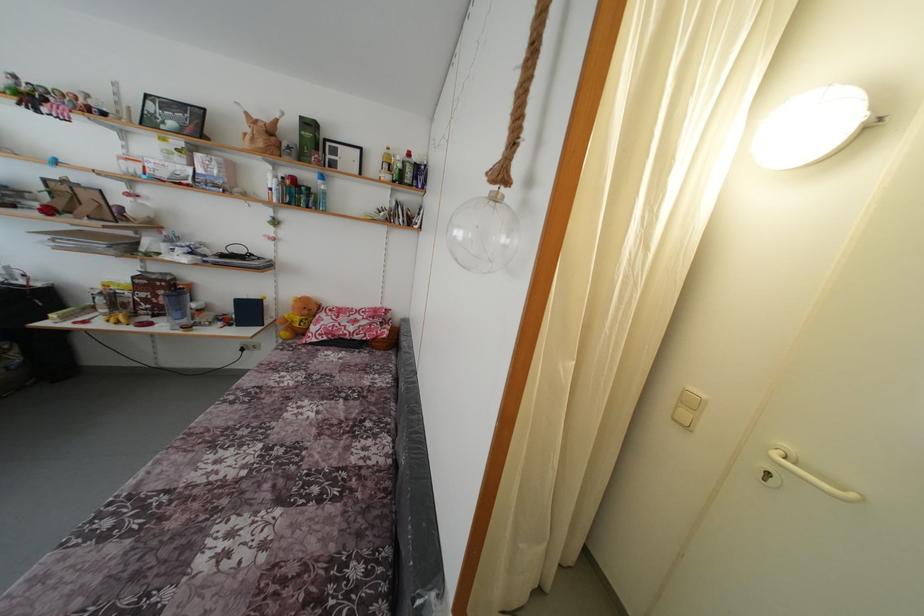
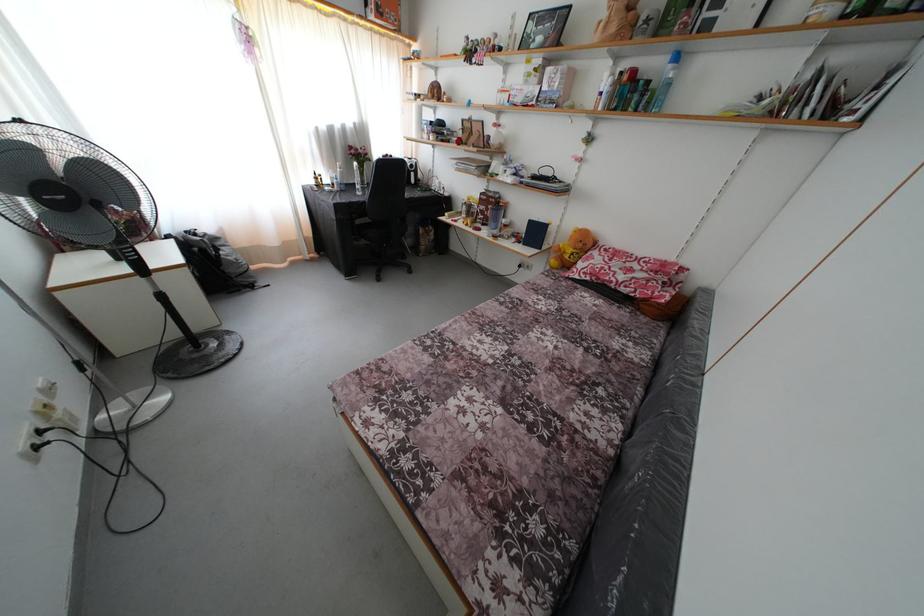
Where in the second image is the point corresponding to (310,317) from the first image?

(585, 251)